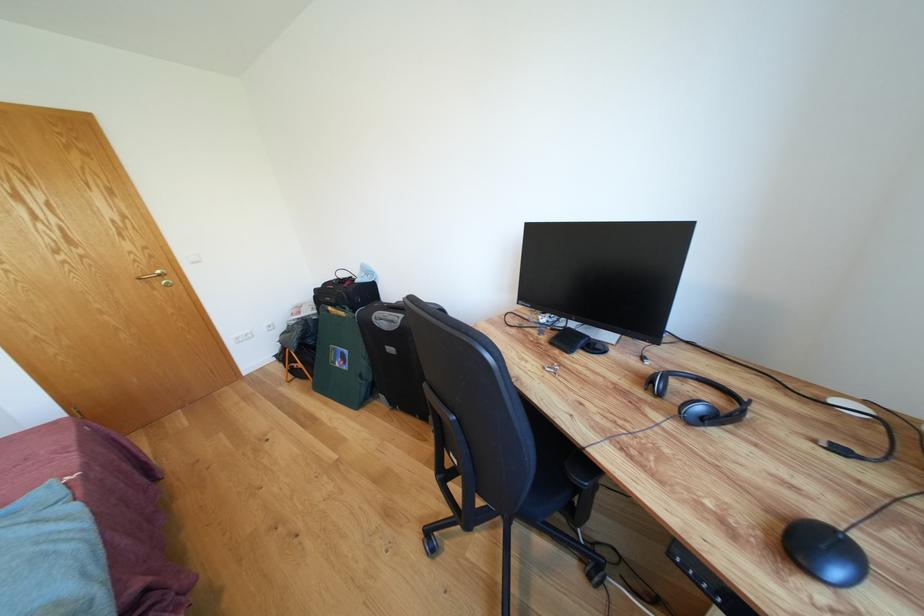
Find the location of `black suitcase`. black suitcase is located at coordinates tap(394, 357).